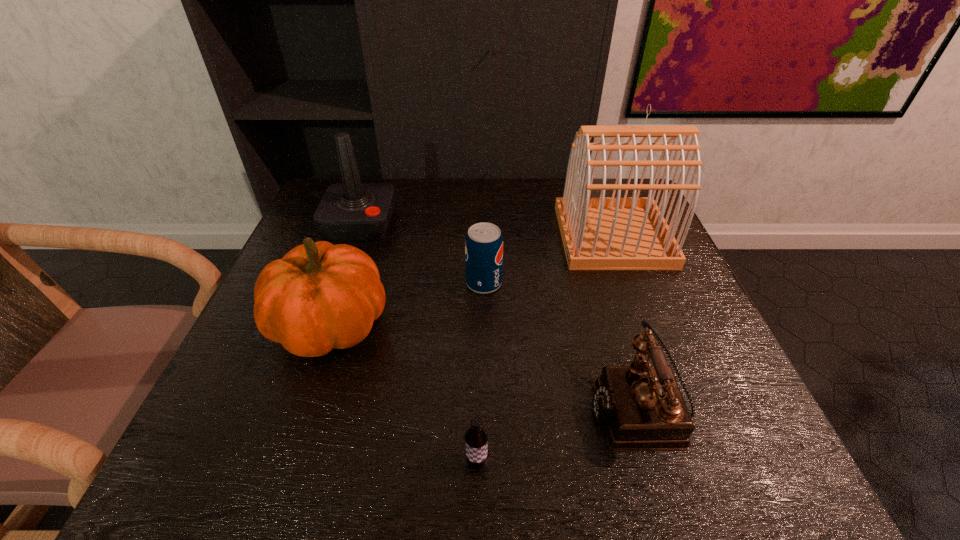
Where is `joystick located in the left edge section of the desktop`? Image resolution: width=960 pixels, height=540 pixels. joystick located in the left edge section of the desktop is located at coordinates (350, 211).

Identify the location of pumpkin located in the left edge section of the desktop. (318, 297).

The image size is (960, 540). I want to click on birdcage situated at the right edge, so click(598, 233).

Where is `telephone situated at the right edge`? This screenshot has height=540, width=960. telephone situated at the right edge is located at coordinates (641, 407).

Find the location of `object situated at the far left corner`. object situated at the far left corner is located at coordinates (350, 211).

Locate an element on the screen. object at the far right corner is located at coordinates (x=598, y=233).

Identify the location of object that is at the near right corner. This screenshot has height=540, width=960. (641, 407).

What are the coordinates of `vacant space at the far edge of the desktop` in the screenshot? It's located at (464, 219).

Find the location of a particular element. The image size is (960, 540). vacant space at the near edge of the desktop is located at coordinates (523, 449).

At what (x,y) coordinates should I click in order to perform the action: click on free space at the right edge. Please return your answer as a coordinate pair (x, y). This screenshot has height=540, width=960. Looking at the image, I should click on (679, 306).